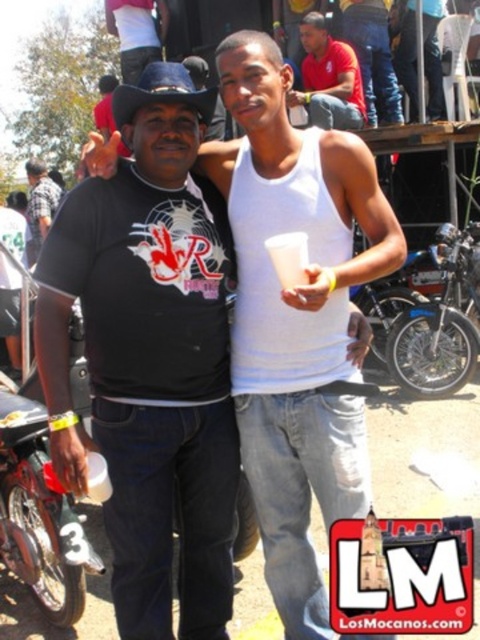
Consider the image. You are organizing a charity event and need to place a small donation box next to the matte black shirt at center and the brushed metal water at bottle left. Which object should the donation box be placed closer to if it needs to be near the larger item?

The donation box should be placed closer to the matte black shirt at center because it has a larger size compared to the brushed metal water at bottle left.

You are standing at the location where the shiny black motorcycle at left is parked. You want to hand a drink to the person wearing the matte red shirt at upper center. Can you reach them without moving from your current position?

The shiny black motorcycle at left is 6.95 meters away from matte red shirt at upper center. Since 6.95 meters is a considerable distance, you cannot reach them without moving from your current position.